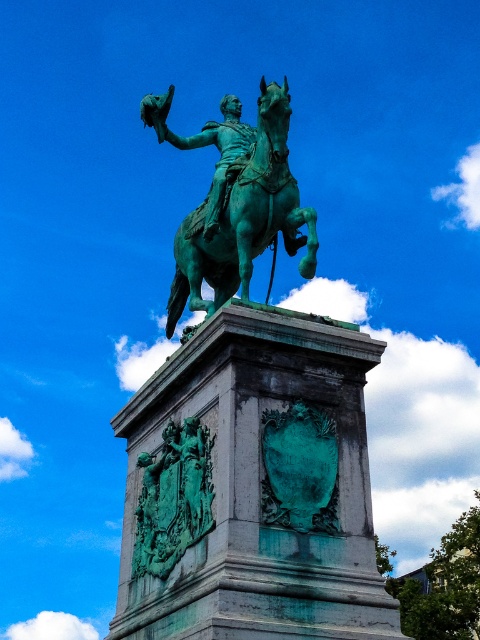
Is green patina horse at center smaller than green patina statue at upper center?

No.

Between green patina horse at center and green patina statue at upper center, which one is positioned higher?

Positioned higher is green patina statue at upper center.

Who is more distant from viewer, (225, 241) or (229, 177)?

Point (225, 241)

At what (x,y) coordinates should I click in order to perform the action: click on green patina horse at center. Please return your answer as a coordinate pair (x, y). Image resolution: width=480 pixels, height=640 pixels. Looking at the image, I should click on (244, 218).

Who is lower down, green patina statue at center or green patina horse at center?

green patina horse at center is lower down.

The image size is (480, 640). I want to click on green patina statue at center, so click(x=251, y=442).

Is green patina shield at center wider than green patina statue at upper center?

No, green patina shield at center is not wider than green patina statue at upper center.

Who is more forward, (205, 529) or (249, 136)?

Point (205, 529)

Where is `green patina shield at center`? The height and width of the screenshot is (640, 480). green patina shield at center is located at coordinates (172, 499).